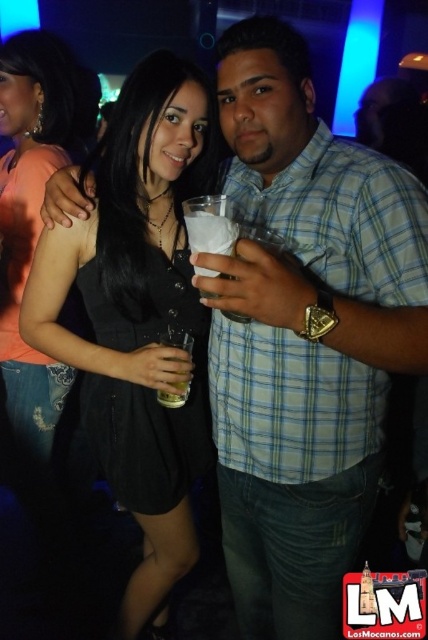
You are a photographer at the party and want to take a photo of the blue plaid shirt at center and the black matte dress at center. Which object should you focus on first if you want to capture the taller one in the frame?

The black matte dress at center is taller than the blue plaid shirt at center, so you should focus on the black matte dress at center first to capture the taller one in the frame.

You are a photographer at the event and want to capture a photo where both the black matte dress at center and the clear plastic cup at center are visible. Given their sizes, which object will occupy more space in the photo?

The black matte dress at center will occupy more space in the photo because its width surpasses that of the clear plastic cup at center.

You are at a party and want to place the clear plastic cup at center on the table next to the black matte dress at center. Considering their sizes, will the cup fit comfortably without overcrowding the space?

The black matte dress at center is larger in size than the clear plastic cup at center, so there should be enough space to place the cup next to the dress without overcrowding the area.